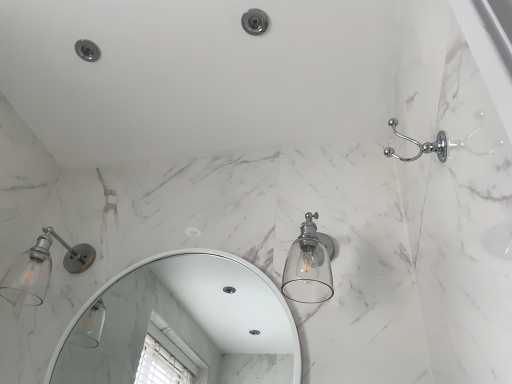
Question: From a real-world perspective, relative to matte white bathtub at upper right, is chrome metallic showerhead at upper center vertically above or below?

Choices:
 (A) above
 (B) below

Answer: (B)

Question: Is chrome metallic showerhead at upper center bigger or smaller than matte white bathtub at upper right?

Choices:
 (A) small
 (B) big

Answer: (A)

Question: Based on their relative distances, which object is nearer to the matte silver glass sconce at left, which is counted as the 1th light fixture, starting from the left?

Choices:
 (A) clear glass light fixture at center-right, the first light fixture positioned from the right
 (B) matte white bathtub at upper right
 (C) chrome metallic showerhead at upper center
 (D) white glossy mirror at center

Answer: (B)

Question: Based on their relative distances, which object is farther from the white glossy mirror at center?

Choices:
 (A) chrome metallic showerhead at upper center
 (B) clear glass light fixture at center-right, the first light fixture positioned from the right
 (C) matte silver glass sconce at left, which is counted as the 1th light fixture, starting from the left
 (D) matte white bathtub at upper right

Answer: (A)